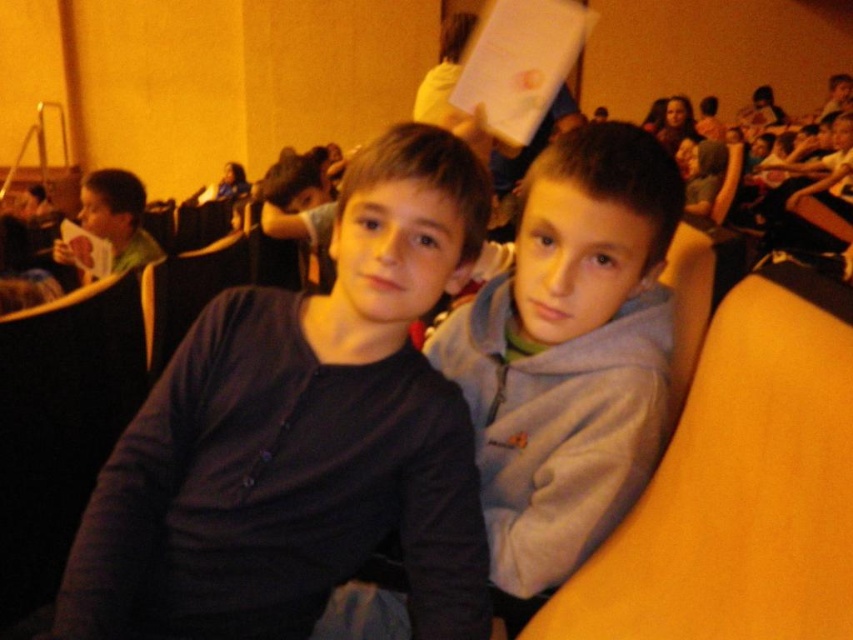
You are sitting in the middle row of an auditorium and notice two sweaters worn by boys in front of you. The dark blue sweater at center and the matte green sweater at left. Which sweater is positioned closer to the left side of the auditorium?

The matte green sweater at left is positioned closer to the left side of the auditorium because the dark blue sweater at center is to the right of it.

You are sitting in the front row of an auditorium and see the dark blue shirt at center and the blue fabric shirt at upper left. Which one is closer to the stage?

The dark blue shirt at center is closer to the stage because it is in front of the blue fabric shirt at upper left.

You are trying to decide which seat to choose between the dark blue shirt at center and the matte green sweater at left. Which one is wider?

The dark blue shirt at center might be wider than matte green sweater at left.